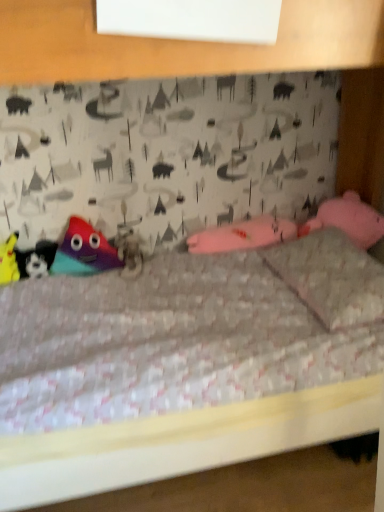
Question: Based on their sizes in the image, would you say matte black plush at left, which is the 2th toy in left-to-right order, is bigger or smaller than fuzzy fabric animal at center?

Choices:
 (A) small
 (B) big

Answer: (A)

Question: Does point (21, 262) appear closer or farther from the camera than point (130, 263)?

Choices:
 (A) farther
 (B) closer

Answer: (B)

Question: Based on their relative distances, which object is farther from the fuzzy fabric animal at center?

Choices:
 (A) multicolored plush toy at left, which ranks as the first toy in right-to-left order
 (B) matte black plush at left, which is the 2th toy in left-to-right order
 (C) yellow fabric toy at lower left, the 1th toy positioned from the left
 (D) pink fabric pillow at upper right

Answer: (D)

Question: Which of these objects is positioned farthest from the yellow fabric toy at lower left, marked as the 3th toy in a right-to-left arrangement?

Choices:
 (A) pink fabric pillow at upper right
 (B) multicolored plush toy at left, arranged as the 3th toy when viewed from the left
 (C) matte black plush at left, which is counted as the second toy, starting from the right
 (D) fuzzy fabric animal at center

Answer: (A)